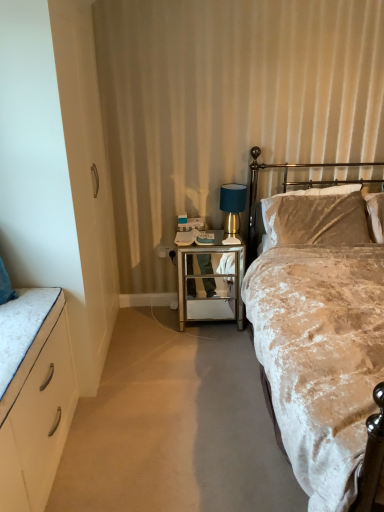
This screenshot has height=512, width=384. I want to click on free space in front of mirrored glass side table at center, so click(x=202, y=345).